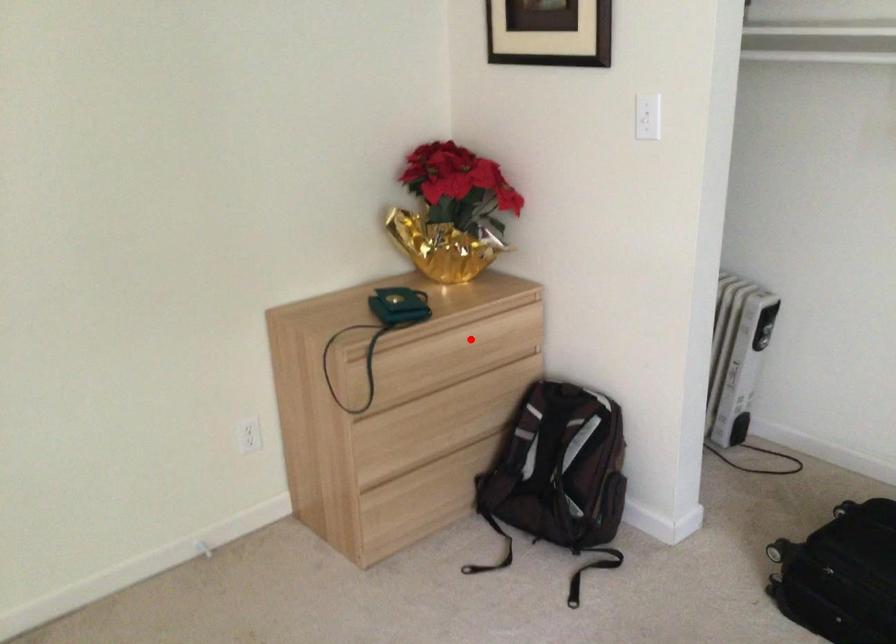
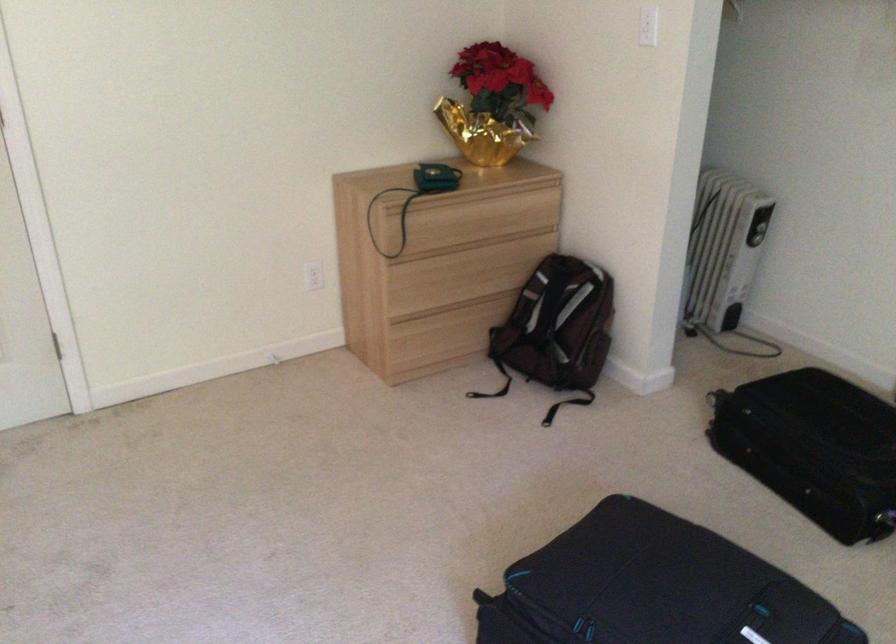
Question: I am providing you with two images of the same scene from different viewpoints. Image1 has a red point marked. In image2, the corresponding 3D location appears at what relative position? Reply with the corresponding letter.

Choices:
 (A) Closer
 (B) Farther

Answer: (B)